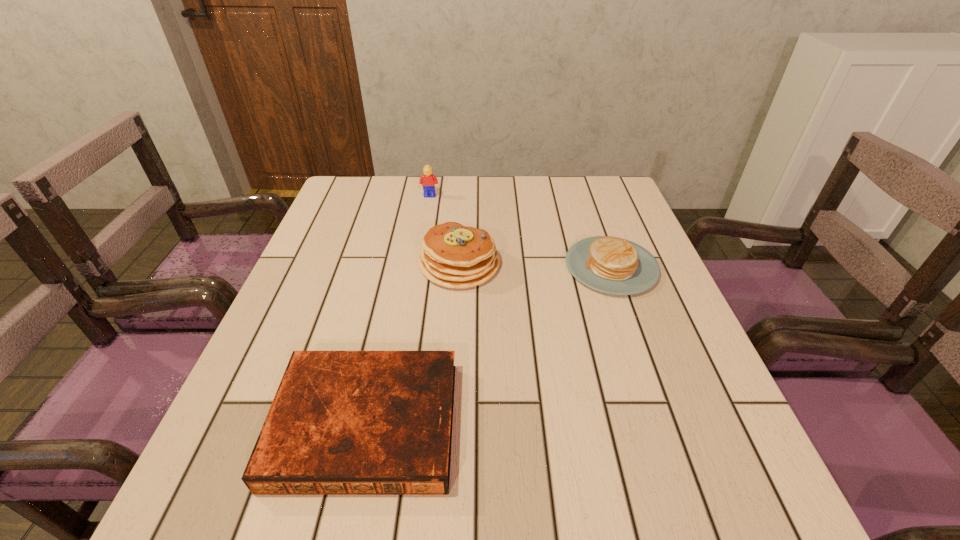
Find the location of a particular element. This screenshot has width=960, height=540. vacant region between the farthest object and the nearest object is located at coordinates (397, 310).

I want to click on vacant area that lies between the left pancake and the right pancake, so click(536, 266).

This screenshot has height=540, width=960. What are the coordinates of `unoccupied position between the Bible and the taller pancake` in the screenshot? It's located at (413, 344).

The height and width of the screenshot is (540, 960). What are the coordinates of `vacant area between the farthest object and the nearest object` in the screenshot? It's located at (397, 310).

Locate an element on the screen. This screenshot has width=960, height=540. empty space between the Bible and the right pancake is located at coordinates (489, 346).

You are a GUI agent. You are given a task and a screenshot of the screen. Output one action in this format:
    pyautogui.click(x=<x>, y=<y>)
    Task: Click on the vacant area between the rightmost object and the taller pancake
    
    Given the screenshot: What is the action you would take?
    pyautogui.click(x=536, y=266)

Identify the location of free space between the farthest object and the Bible. This screenshot has height=540, width=960. (397, 310).

The width and height of the screenshot is (960, 540). I want to click on free space between the nearest object and the Lego, so click(x=397, y=310).

What are the coordinates of `vacant area between the nearest object and the farthest object` in the screenshot? It's located at (397, 310).

The image size is (960, 540). I want to click on object that is the closest to the Lego, so click(455, 256).